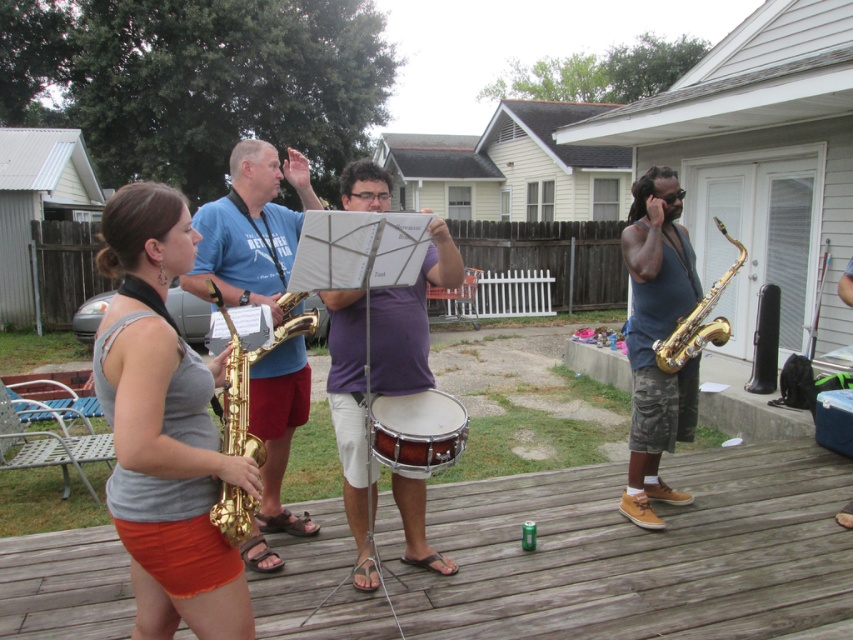
You are organizing a photo shoot and need to ensure that the matte gray tank top at center and the gold shiny saxophone at right are both visible in the frame. Given their sizes, which object might require more space to avoid being cropped?

The gold shiny saxophone at right requires more space as it has a greater width than the matte gray tank top at center.

You are a photographer trying to capture a clear shot of both the matte gray tank top at center and the gold shiny saxophone at center. Which object should you focus on first to ensure both are in focus?

You should focus on the matte gray tank top at center first since it is closer to the viewer than the gold shiny saxophone at center. By focusing on the closer object, the saxophone will also be in focus due to the depth of field.

You are a photographer trying to capture a clear shot of both the mahogany wood snare drum at center and the gold shiny saxophone at right. Based on their heights, which object will appear taller in the photo?

The gold shiny saxophone at right appears taller in the photo since it has a greater height compared to the mahogany wood snare drum at center.